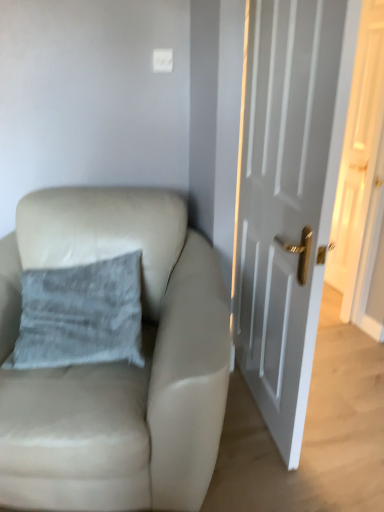
Question: Looking at their shapes, would you say white glossy door at right, the second door from the back, is wider or thinner than beige leather chair at left?

Choices:
 (A) wide
 (B) thin

Answer: (B)

Question: From the image's perspective, relative to beige leather chair at left, is white glossy door at right, positioned as the first door in front-to-back order, above or below?

Choices:
 (A) below
 (B) above

Answer: (B)

Question: Which object is the farthest from the white glossy door at right, which appears as the 1th door when viewed from the left?

Choices:
 (A) beige leather chair at left
 (B) white glossy door at right, which is the 1th door in right-to-left order
 (C) gray fabric pillow at upper left

Answer: (B)

Question: Based on their relative distances, which object is nearer to the beige leather chair at left?

Choices:
 (A) white glossy door at right, which is counted as the 1th door, starting from the back
 (B) gray fabric pillow at upper left
 (C) white glossy door at right, the second door in the right-to-left sequence

Answer: (B)